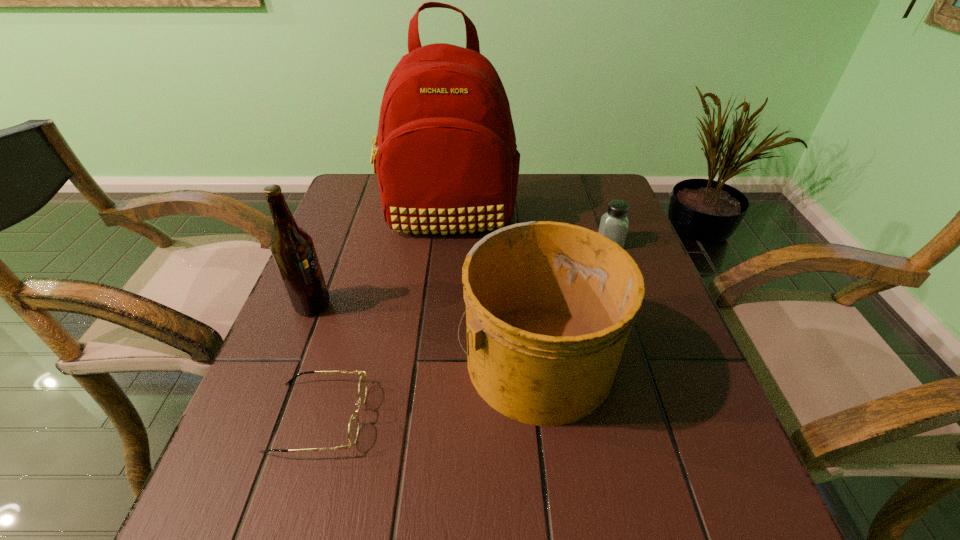
Locate an element on the screen. The height and width of the screenshot is (540, 960). vacant space that is in between the beer bottle and the bucket is located at coordinates (424, 332).

The height and width of the screenshot is (540, 960). I want to click on free point between the tallest object and the fourth shortest object, so click(x=380, y=260).

At what (x,y) coordinates should I click in order to perform the action: click on free spot between the shortest object and the backpack. Please return your answer as a coordinate pair (x, y). The image size is (960, 540). Looking at the image, I should click on (383, 316).

Where is `object that is the fourth closest to the spectacles`? This screenshot has width=960, height=540. object that is the fourth closest to the spectacles is located at coordinates (614, 223).

Choose which object is the third nearest neighbor to the beer bottle. Please provide its 2D coordinates. Your answer should be formatted as a tuple, i.e. [(x, y)], where the tuple contains the x and y coordinates of a point satisfying the conditions above.

[(549, 305)]

The image size is (960, 540). In order to click on blank area in the image that satisfies the following two spatial constraints: 1. on the front-facing side of the tallest object; 2. on the left side of the rightmost object in this screenshot , I will do `click(445, 243)`.

You are a GUI agent. You are given a task and a screenshot of the screen. Output one action in this format:
    pyautogui.click(x=<x>, y=<y>)
    Task: Click on the free location that satisfies the following two spatial constraints: 1. on the front side of the fourth tallest object; 2. on the lenses of the shortest object
    This screenshot has width=960, height=540.
    Given the screenshot: What is the action you would take?
    pyautogui.click(x=672, y=417)

The width and height of the screenshot is (960, 540). Identify the location of vacant space that satisfies the following two spatial constraints: 1. on the front-facing side of the tallest object; 2. on the label of the beer bottle. (440, 305).

The width and height of the screenshot is (960, 540). I want to click on blank space that satisfies the following two spatial constraints: 1. on the front side of the saltshaker; 2. on the label of the second tallest object, so click(x=632, y=305).

The image size is (960, 540). In order to click on vacant space that satisfies the following two spatial constraints: 1. on the front-facing side of the bucket; 2. on the left side of the tallest object in this screenshot , I will do `click(435, 357)`.